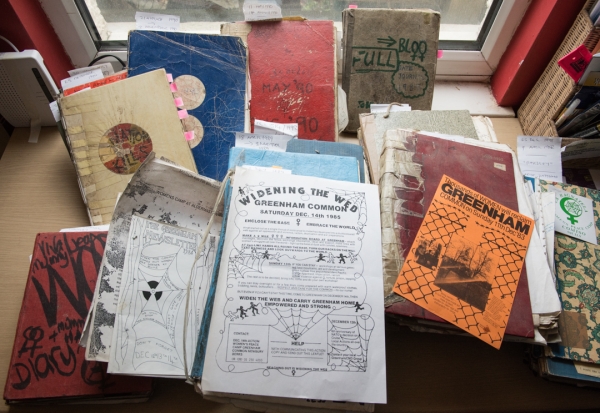
Find the location of a particular element. pink post-it tabs is located at coordinates (190, 135), (183, 115), (180, 102), (173, 87), (170, 77).